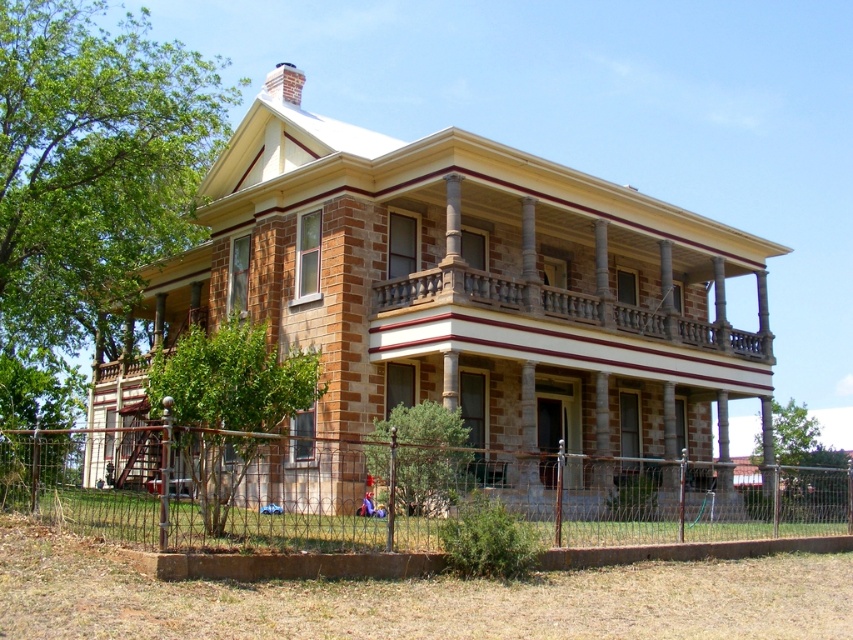
You are a painter standing at the rusty metal fence at lower center and need to reach the brown stone balcony at upper center to paint it. Can you estimate whether the ladder you have, which is 18 feet long, will be sufficient to reach the balcony?

The distance between the rusty metal fence at lower center and the brown stone balcony at upper center is 20.09 feet. Since the ladder is only 18 feet long, it would not be long enough to reach the balcony from the fence.

You are a delivery person with a 1.5 meter wide delivery truck. You need to drive through the gap between the rusty metal fence at lower center and the house. Can your truck fit through the gap?

The gap between the rusty metal fence at lower center and the house is 14.06 meters, so yes, the delivery truck can fit through the gap since it is wider than the truck.

You are standing at the front of the house and want to walk to the brown stone balcony at upper center. Which direction should you move relative to the rusty metal fence at lower center?

You should move to the right side of the rusty metal fence at lower center to reach the brown stone balcony at upper center since the rusty metal fence at lower center is positioned on the left side of brown stone balcony at upper center.